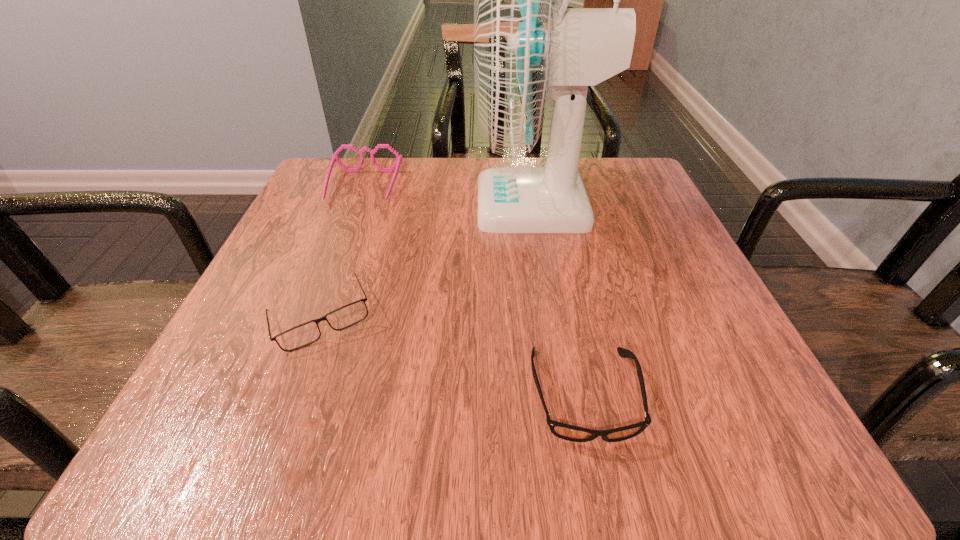
The width and height of the screenshot is (960, 540). In the image, there is a desktop. Find the location of `vacant space at the near left corner`. vacant space at the near left corner is located at coordinates point(203,424).

Identify the location of vacant space at the far right corner. Image resolution: width=960 pixels, height=540 pixels. click(628, 213).

Locate an element on the screen. The image size is (960, 540). empty space between the second tallest object and the rightmost spectacles is located at coordinates (474, 291).

At what (x,y) coordinates should I click in order to perform the action: click on empty space between the rightmost spectacles and the fan. Please return your answer as a coordinate pair (x, y). Image resolution: width=960 pixels, height=540 pixels. Looking at the image, I should click on (560, 300).

Where is `free space between the second tallest object and the rightmost spectacles`? free space between the second tallest object and the rightmost spectacles is located at coordinates (474, 291).

Locate an element on the screen. This screenshot has width=960, height=540. vacant region between the shortest object and the tallest spectacles is located at coordinates (474, 291).

Locate an element on the screen. the third closest object to the tallest spectacles is located at coordinates (564, 431).

At what (x,y) coordinates should I click in order to perform the action: click on object that is the second closest to the tallest spectacles. Please return your answer as a coordinate pair (x, y). The image size is (960, 540). Looking at the image, I should click on (348, 315).

The width and height of the screenshot is (960, 540). What are the coordinates of `spectacles identified as the closest to the tallest object` in the screenshot? It's located at (334, 157).

Image resolution: width=960 pixels, height=540 pixels. Identify the location of the closest spectacles to the second tallest object. (348, 315).